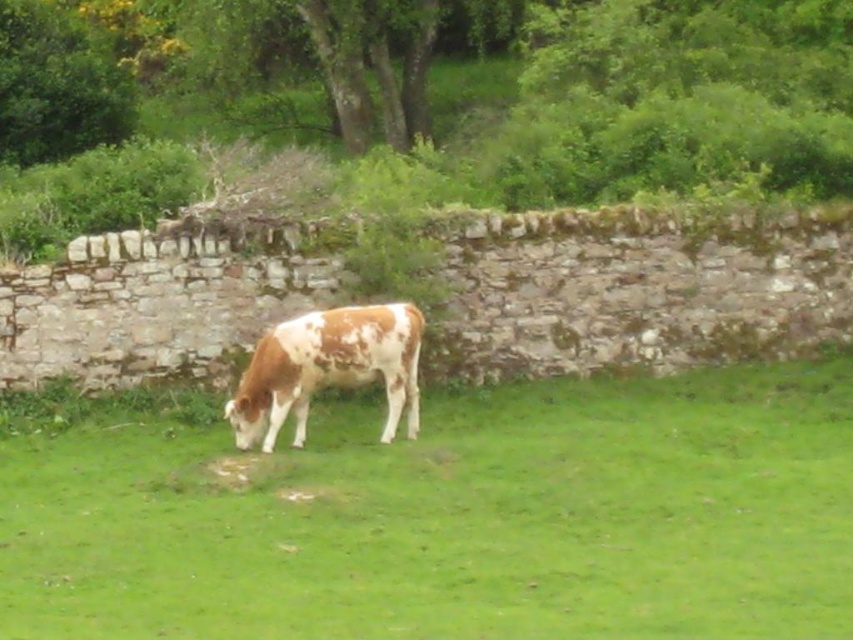
You are standing in the field and want to walk to the cow. Which point, point (289, 605) or point (405, 312), is closer to you?

Point (289, 605) is closer to the camera than point (405, 312), so it is closer to you.

You are standing in the field and see two cows in the image. Which cow is closer to you, the brown speckled cow at center or the speckled brown cow at center?

The brown speckled cow at center is closer to the viewer than the speckled brown cow at center.

You are standing at the point marked as point (440,513) in the image. What object is located exactly at that point?

The brown speckled cow at center is located exactly at point (440,513).